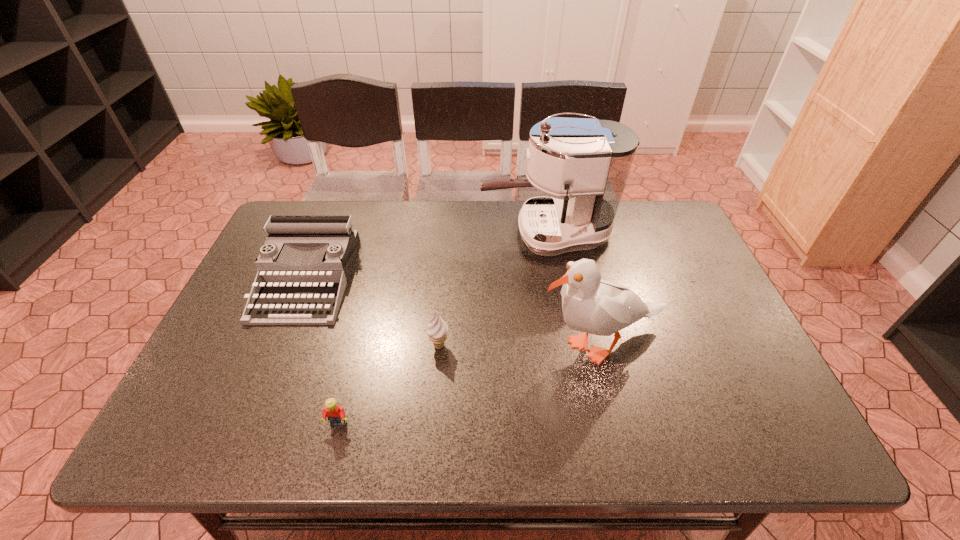
Locate an element on the screen. This screenshot has height=540, width=960. vacant space situated at the beak of the second tallest object is located at coordinates (480, 346).

Locate an element on the screen. Image resolution: width=960 pixels, height=540 pixels. free space located 0.370m at the beak of the second tallest object is located at coordinates (381, 346).

Where is `vacant space positioned on the front-facing side of the icecream`? Image resolution: width=960 pixels, height=540 pixels. vacant space positioned on the front-facing side of the icecream is located at coordinates (437, 372).

Locate an element on the screen. vacant space located 0.190m on the typing side of the typewriter is located at coordinates (262, 390).

Locate an element on the screen. This screenshot has width=960, height=540. coffee maker that is positioned at the far edge is located at coordinates (589, 160).

Where is `typewriter that is at the far edge`? The image size is (960, 540). typewriter that is at the far edge is located at coordinates (295, 298).

Where is `object that is positioned at the near edge`? object that is positioned at the near edge is located at coordinates (336, 415).

Find the location of a particular element. This screenshot has height=540, width=960. object situated at the left edge is located at coordinates (295, 298).

Find the location of a particular element. object present at the far left corner is located at coordinates (295, 298).

This screenshot has height=540, width=960. What are the coordinates of `free space at the far edge` in the screenshot? It's located at (437, 235).